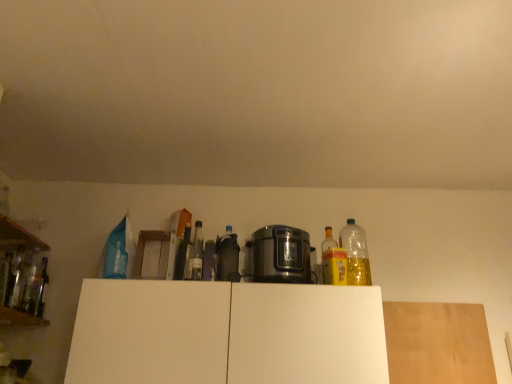
What is the approximate width of satin metallic rice cooker at center?

8.96 inches.

The width and height of the screenshot is (512, 384). What do you see at coordinates (280, 255) in the screenshot?
I see `satin metallic rice cooker at center` at bounding box center [280, 255].

What is the approximate height of wooden at left, placed as the 1th shelf when sorted from top to bottom?

The height of wooden at left, placed as the 1th shelf when sorted from top to bottom, is 6.73 centimeters.

Where is `clear glass bottles at left, the sixth bottle when ordered from right to left`? The width and height of the screenshot is (512, 384). clear glass bottles at left, the sixth bottle when ordered from right to left is located at coordinates (33, 289).

Measure the distance between clear glass bottles at left, which appears as the third bottle when viewed from the left, and camera.

A distance of 1.94 meters exists between clear glass bottles at left, which appears as the third bottle when viewed from the left, and camera.

Locate an element on the screen. white matte cabinet at center is located at coordinates (226, 333).

Locate an element on the screen. The height and width of the screenshot is (384, 512). shelf that appears behind the wooden at left, the 1th shelf when ordered from bottom to top is located at coordinates (18, 237).

Is wooden at left, placed as the 1th shelf when sorted from top to bottom, at the back of wooden at left, the 1th shelf when ordered from bottom to top?

wooden at left, the 1th shelf when ordered from bottom to top, is not turned away from wooden at left, placed as the 1th shelf when sorted from top to bottom.

Considering the positions of objects wooden at left, the 2th shelf positioned from the top, and wooden at left, placed as the 1th shelf when sorted from top to bottom, in the image provided, who is behind, wooden at left, the 2th shelf positioned from the top, or wooden at left, placed as the 1th shelf when sorted from top to bottom,?

wooden at left, placed as the 1th shelf when sorted from top to bottom, is behind.

From the picture: Can you tell me how much wooden at left, the 2th shelf positioned from the top, and wooden at left, which is counted as the second shelf, starting from the bottom, differ in facing direction?

0.769 degrees separate the facing orientations of wooden at left, the 2th shelf positioned from the top, and wooden at left, which is counted as the second shelf, starting from the bottom.

Which object is thinner, translucent plastic bottle at center, marked as the sixth bottle in a left-to-right arrangement, or satin metallic rice cooker at center?

translucent plastic bottle at center, marked as the sixth bottle in a left-to-right arrangement, is thinner.

From the image's perspective, is translucent plastic bottle at center, the third bottle when ordered from right to left, above or below satin metallic rice cooker at center?

From the image's perspective, translucent plastic bottle at center, the third bottle when ordered from right to left, appears above satin metallic rice cooker at center.

From the satin metallic rice cooker at center, count the 1st bottle to the left and point to it. Please provide its 2D coordinates.

[(227, 257)]

Is translucent plastic bottle at center, the third bottle when ordered from right to left, at the right side of satin metallic rice cooker at center?

In fact, translucent plastic bottle at center, the third bottle when ordered from right to left, is to the left of satin metallic rice cooker at center.

From the image's perspective, between yellow translucent bottle at center, which is the 2th bottle in right-to-left order, and clear glass bottle at left, the second bottle from the left, who is located below?

clear glass bottle at left, the second bottle from the left, appears lower in the image.

Would you say yellow translucent bottle at center, the seventh bottle from the left, is outside clear glass bottle at left, the second bottle from the left?

yellow translucent bottle at center, the seventh bottle from the left, is positioned outside clear glass bottle at left, the second bottle from the left.

Considering the sizes of objects yellow translucent bottle at center, which is the 2th bottle in right-to-left order, and clear glass bottle at left, the second bottle from the left, in the image provided, who is shorter, yellow translucent bottle at center, which is the 2th bottle in right-to-left order, or clear glass bottle at left, the second bottle from the left,?

clear glass bottle at left, the second bottle from the left, is shorter.

Can you tell me how much yellow translucent bottle at center, which is the 2th bottle in right-to-left order, and clear glass bottle at left, the second bottle from the left, differ in facing direction?

88.7 degrees separate the facing orientations of yellow translucent bottle at center, which is the 2th bottle in right-to-left order, and clear glass bottle at left, the second bottle from the left.

From the image's perspective, which object appears higher, translucent plastic bottle at center, marked as the sixth bottle in a left-to-right arrangement, or yellow translucent bottle at center, the seventh bottle from the left?

From the image's view, translucent plastic bottle at center, marked as the sixth bottle in a left-to-right arrangement, is above.

This screenshot has height=384, width=512. In order to click on the 2nd bottle behind the translucent plastic bottle at center, the third bottle when ordered from right to left in this screenshot , I will do `click(327, 255)`.

Which object is positioned more to the right, translucent plastic bottle at center, the third bottle when ordered from right to left, or yellow translucent bottle at center, which is the 2th bottle in right-to-left order?

Positioned to the right is yellow translucent bottle at center, which is the 2th bottle in right-to-left order.

Does translucent plastic bottle at center, marked as the sixth bottle in a left-to-right arrangement, touch yellow translucent bottle at center, which is the 2th bottle in right-to-left order?

No.

Is translucent plastic bottle at upper right, the eighth bottle from the left, surrounding wooden at left, the 1th shelf when ordered from bottom to top?

Actually, wooden at left, the 1th shelf when ordered from bottom to top, is outside translucent plastic bottle at upper right, the eighth bottle from the left.

In the scene shown: Is translucent plastic bottle at upper right, the 1th bottle viewed from the right, to the right of wooden at left, the 2th shelf positioned from the top, from the viewer's perspective?

Correct, you'll find translucent plastic bottle at upper right, the 1th bottle viewed from the right, to the right of wooden at left, the 2th shelf positioned from the top.

Is translucent plastic bottle at upper right, the eighth bottle from the left, taller or shorter than wooden at left, the 1th shelf when ordered from bottom to top?

In the image, translucent plastic bottle at upper right, the eighth bottle from the left, appears to be taller than wooden at left, the 1th shelf when ordered from bottom to top.

From a real-world perspective, is translucent plastic bottle at upper right, the 1th bottle viewed from the right, positioned above or below wooden at left, the 2th shelf positioned from the top?

translucent plastic bottle at upper right, the 1th bottle viewed from the right, is above wooden at left, the 2th shelf positioned from the top.

From the picture: What's the angular difference between clear glass bottle at left, the second bottle from the left, and clear glass bottles at left, which appears as the third bottle when viewed from the left,'s facing directions?

The angle between the facing direction of clear glass bottle at left, the second bottle from the left, and the facing direction of clear glass bottles at left, which appears as the third bottle when viewed from the left, is 0.00234 degrees.

From the image's perspective, is clear glass bottle at left, the second bottle from the left, under clear glass bottles at left, the sixth bottle when ordered from right to left?

Actually, clear glass bottle at left, the second bottle from the left, appears above clear glass bottles at left, the sixth bottle when ordered from right to left, in the image.

Is clear glass bottle at left, the 7th bottle in the right-to-left sequence, aimed at clear glass bottles at left, which appears as the third bottle when viewed from the left?

No.

Are wooden at left, the 1th shelf when ordered from bottom to top, and yellow translucent bottle at center, the seventh bottle from the left, far apart?

wooden at left, the 1th shelf when ordered from bottom to top, is positioned a significant distance from yellow translucent bottle at center, the seventh bottle from the left.

Does wooden at left, the 2th shelf positioned from the top, have a larger size compared to yellow translucent bottle at center, which is the 2th bottle in right-to-left order?

Yes, wooden at left, the 2th shelf positioned from the top, is bigger than yellow translucent bottle at center, which is the 2th bottle in right-to-left order.

Can you confirm if wooden at left, the 2th shelf positioned from the top, is shorter than yellow translucent bottle at center, the seventh bottle from the left?

Yes.

Does wooden at left, the 2th shelf positioned from the top, have a lesser width compared to yellow translucent bottle at center, the seventh bottle from the left?

Incorrect, the width of wooden at left, the 2th shelf positioned from the top, is not less than that of yellow translucent bottle at center, the seventh bottle from the left.

Identify the location of shelf below the wooden at left, placed as the 1th shelf when sorted from top to bottom (from a real-world perspective). This screenshot has width=512, height=384. (20, 319).

Find the location of `bottle that is the 1st one when counting leftward from the satin metallic rice cooker at center`. bottle that is the 1st one when counting leftward from the satin metallic rice cooker at center is located at coordinates (227, 257).

Estimate the real-world distances between objects in this image. Which object is further from light brown wood at upper center, clear glass bottle at left, the 7th bottle in the right-to-left sequence, or clear glass bottles at left, which appears as the third bottle when viewed from the left?

clear glass bottle at left, the 7th bottle in the right-to-left sequence, is positioned further to the anchor light brown wood at upper center.

Looking at the image, which one is located closer to translucent plastic bottle at center, marked as the sixth bottle in a left-to-right arrangement, white matte cabinet at center or wooden at left, which is counted as the second shelf, starting from the bottom?

white matte cabinet at center is positioned closer to the anchor translucent plastic bottle at center, marked as the sixth bottle in a left-to-right arrangement.

Estimate the real-world distances between objects in this image. Which object is further from clear glass bottle at left, which appears as the 1th bottle when viewed from the left, wooden at left, placed as the 1th shelf when sorted from top to bottom, or translucent plastic bottle at upper right, the 1th bottle viewed from the right?

translucent plastic bottle at upper right, the 1th bottle viewed from the right.

Based on the photo, when comparing their distances from wooden at left, the 1th shelf when ordered from bottom to top, does clear glass bottle at left, which appears as the 1th bottle when viewed from the left, or yellow translucent bottle at center, the seventh bottle from the left, seem closer?

Based on the image, clear glass bottle at left, which appears as the 1th bottle when viewed from the left, appears to be nearer to wooden at left, the 1th shelf when ordered from bottom to top.

Which object lies further to the anchor point clear glass bottle at left, positioned as the eighth bottle in right-to-left order, white matte cabinet at center or satin metallic rice cooker at center?

satin metallic rice cooker at center.

Looking at the image, which one is located further to wooden at left, which is counted as the second shelf, starting from the bottom, translucent plastic bottle at center, marked as the sixth bottle in a left-to-right arrangement, or yellow translucent bottle at center, which is the 2th bottle in right-to-left order?

yellow translucent bottle at center, which is the 2th bottle in right-to-left order, lies further to wooden at left, which is counted as the second shelf, starting from the bottom, than the other object.

Considering their positions, is translucent plastic bottle at center, the third bottle when ordered from right to left, positioned closer to green glass bottle at center, the 4th bottle from the left, than clear glass bottle at center, which ranks as the fourth bottle in right-to-left order?

Among the two, clear glass bottle at center, which ranks as the fourth bottle in right-to-left order, is located nearer to green glass bottle at center, the 4th bottle from the left.

When comparing their distances from satin metallic rice cooker at center, does light brown wood at upper center or white matte cabinet at center seem further?

light brown wood at upper center is positioned further to the anchor satin metallic rice cooker at center.

Find the location of `cabinetry situated between clear glass bottle at left, the 7th bottle in the right-to-left sequence, and translucent plastic bottle at upper right, the eighth bottle from the left, from left to right`. cabinetry situated between clear glass bottle at left, the 7th bottle in the right-to-left sequence, and translucent plastic bottle at upper right, the eighth bottle from the left, from left to right is located at coordinates (226, 333).

In order to click on home appliance located between clear glass bottle at center, which ranks as the fourth bottle in right-to-left order, and translucent plastic bottle at upper right, the 1th bottle viewed from the right, in the left-right direction in this screenshot , I will do `click(280, 255)`.

At what (x,y) coordinates should I click in order to perform the action: click on home appliance situated between clear glass bottle at left, positioned as the eighth bottle in right-to-left order, and light brown wood at upper center from left to right. Please return your answer as a coordinate pair (x, y). Looking at the image, I should click on (280, 255).

Locate an element on the screen. This screenshot has width=512, height=384. cabinetry situated between clear glass bottle at left, the second bottle from the left, and light brown wood at upper center from left to right is located at coordinates (226, 333).